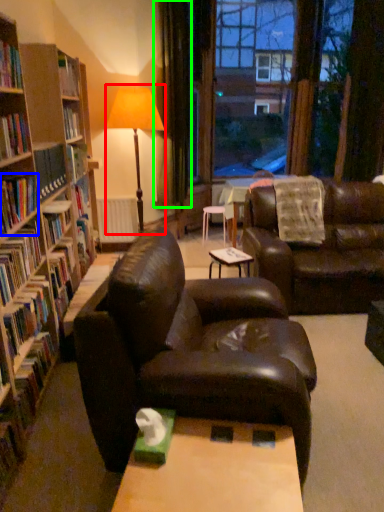
Question: Based on their relative distances, which object is farther from table lamp (highlighted by a red box)? Choose from book (highlighted by a blue box) and curtain (highlighted by a green box).

Choices:
 (A) book
 (B) curtain

Answer: (A)